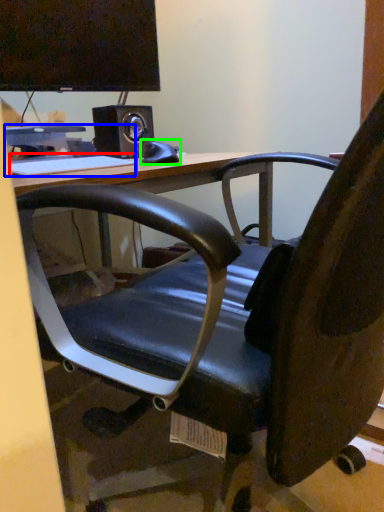
Question: Based on their relative distances, which object is nearer to keyboard (highlighted by a red box)? Choose from computer (highlighted by a blue box) and equipment (highlighted by a green box).

Choices:
 (A) computer
 (B) equipment

Answer: (A)